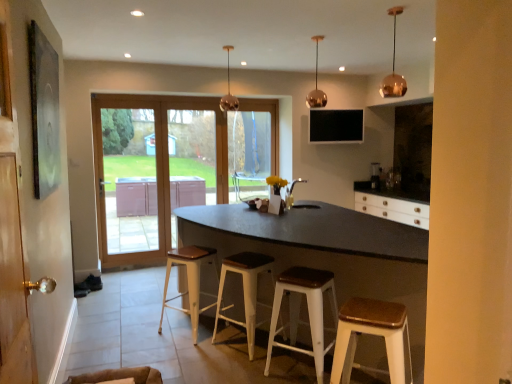
Locate an element on the screen. This screenshot has width=512, height=384. free space above metallic gold pendant light at upper center, placed as the first light fixture when sorted from back to front (from a real-world perspective) is located at coordinates (231, 46).